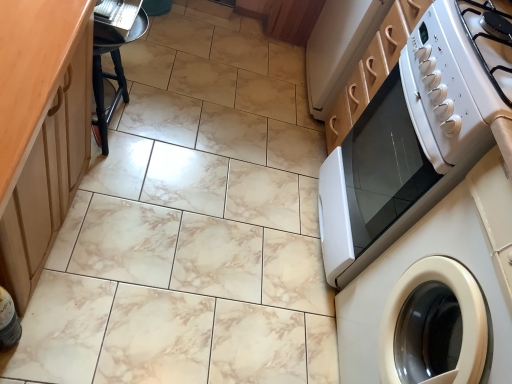
Question: In terms of width, does white glossy microwave at right look wider or thinner when compared to black wood bar stool at left?

Choices:
 (A) thin
 (B) wide

Answer: (B)

Question: From the image's perspective, is white glossy microwave at right above or below black wood bar stool at left?

Choices:
 (A) below
 (B) above

Answer: (A)

Question: Which object is positioned closest to the black wood bar stool at left?

Choices:
 (A) white glossy gas stove at upper right
 (B) white glossy washing machine at right
 (C) wooden at left
 (D) white glossy microwave at right

Answer: (C)

Question: Based on their relative distances, which object is nearer to the white glossy gas stove at upper right?

Choices:
 (A) black wood bar stool at left
 (B) white glossy washing machine at right
 (C) wooden at left
 (D) white glossy microwave at right

Answer: (D)